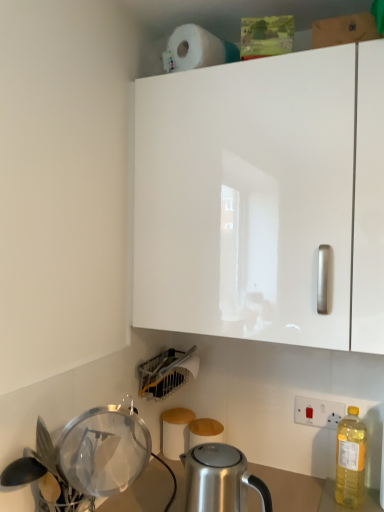
Question: Does matte plastic dish rack at lower center, the second appliance from the front, have a smaller size compared to white matte paper towel at upper center?

Choices:
 (A) yes
 (B) no

Answer: (B)

Question: Is matte plastic dish rack at lower center, the second appliance from the front, aimed at white matte paper towel at upper center?

Choices:
 (A) no
 (B) yes

Answer: (A)

Question: Is matte plastic dish rack at lower center, which ranks as the first appliance in back-to-front order, thinner than white matte paper towel at upper center?

Choices:
 (A) no
 (B) yes

Answer: (A)

Question: Is matte plastic dish rack at lower center, which ranks as the first appliance in back-to-front order, further to camera compared to white matte paper towel at upper center?

Choices:
 (A) yes
 (B) no

Answer: (A)

Question: Does matte plastic dish rack at lower center, the second appliance from the front, appear on the left side of white matte paper towel at upper center?

Choices:
 (A) yes
 (B) no

Answer: (A)

Question: Is yellow translucent bottle at right in front of or behind white glossy cabinet at upper center in the image?

Choices:
 (A) behind
 (B) front

Answer: (A)

Question: From the image's perspective, is yellow translucent bottle at right located above or below white glossy cabinet at upper center?

Choices:
 (A) below
 (B) above

Answer: (A)

Question: Is yellow translucent bottle at right spatially inside white glossy cabinet at upper center, or outside of it?

Choices:
 (A) outside
 (B) inside

Answer: (A)

Question: Looking at their shapes, would you say yellow translucent bottle at right is wider or thinner than white glossy cabinet at upper center?

Choices:
 (A) wide
 (B) thin

Answer: (B)

Question: Is transparent plastic strainer at lower left, the 2th appliance positioned from the back, inside the boundaries of satin silver kettle at lower center, or outside?

Choices:
 (A) inside
 (B) outside

Answer: (B)

Question: From the image's perspective, is transparent plastic strainer at lower left, the 2th appliance positioned from the back, positioned above or below satin silver kettle at lower center?

Choices:
 (A) above
 (B) below

Answer: (A)

Question: Looking at their shapes, would you say transparent plastic strainer at lower left, the 2th appliance positioned from the back, is wider or thinner than satin silver kettle at lower center?

Choices:
 (A) wide
 (B) thin

Answer: (B)

Question: Visually, is transparent plastic strainer at lower left, which appears as the 1th appliance when viewed from the front, positioned to the left or to the right of satin silver kettle at lower center?

Choices:
 (A) left
 (B) right

Answer: (A)

Question: Is point (162, 438) positioned closer to the camera than point (86, 479)?

Choices:
 (A) closer
 (B) farther

Answer: (B)

Question: Relative to transparent plastic strainer at lower left, the 2th appliance positioned from the back, is white matte toilet paper at lower center in front or behind?

Choices:
 (A) behind
 (B) front

Answer: (A)